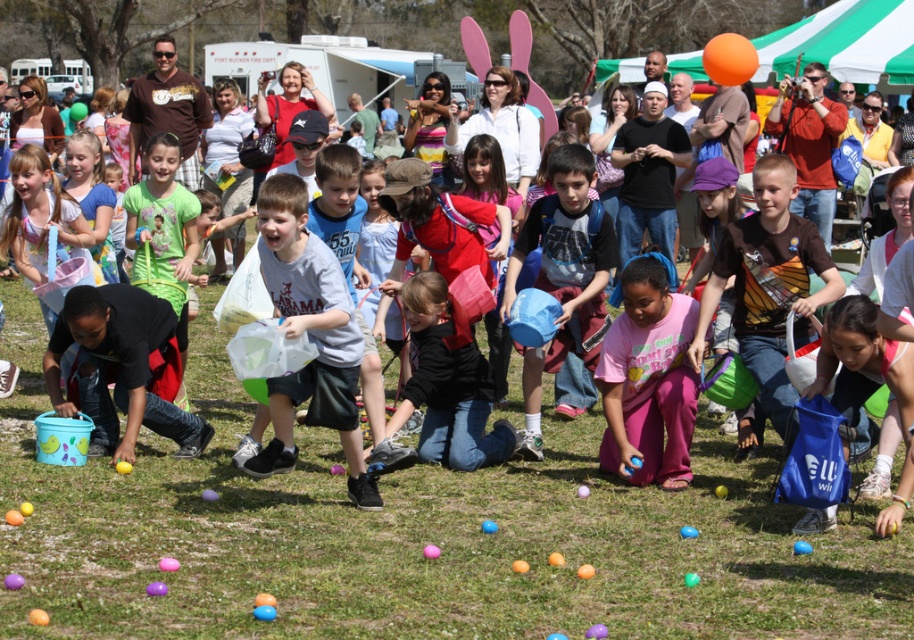
Question: Which point is closer to the camera taking this photo?

Choices:
 (A) (23, 307)
 (B) (604, 362)

Answer: (B)

Question: Does green grass at center appear on the right side of pink matte pants at center?

Choices:
 (A) no
 (B) yes

Answer: (A)

Question: Which of the following is the closest to the observer?

Choices:
 (A) blue fabric bucket at center
 (B) pink matte pants at center

Answer: (B)

Question: Among these points, which one is farthest from the camera?

Choices:
 (A) (210, 397)
 (B) (588, 168)

Answer: (A)

Question: Is light gray t-shirt at center below black matte jacket at center?

Choices:
 (A) yes
 (B) no

Answer: (B)

Question: Does light gray t-shirt at center have a greater width compared to blue fabric bucket at center?

Choices:
 (A) yes
 (B) no

Answer: (A)